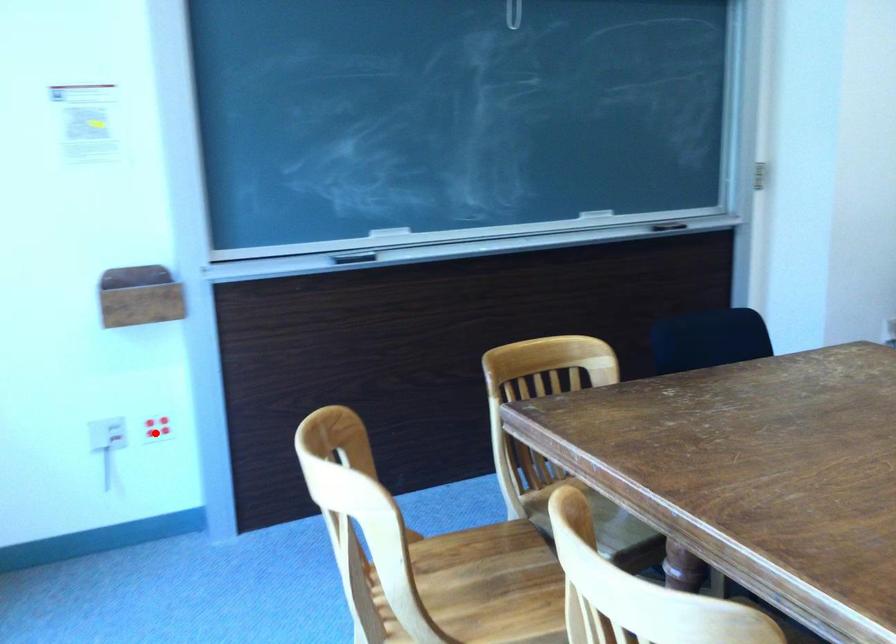
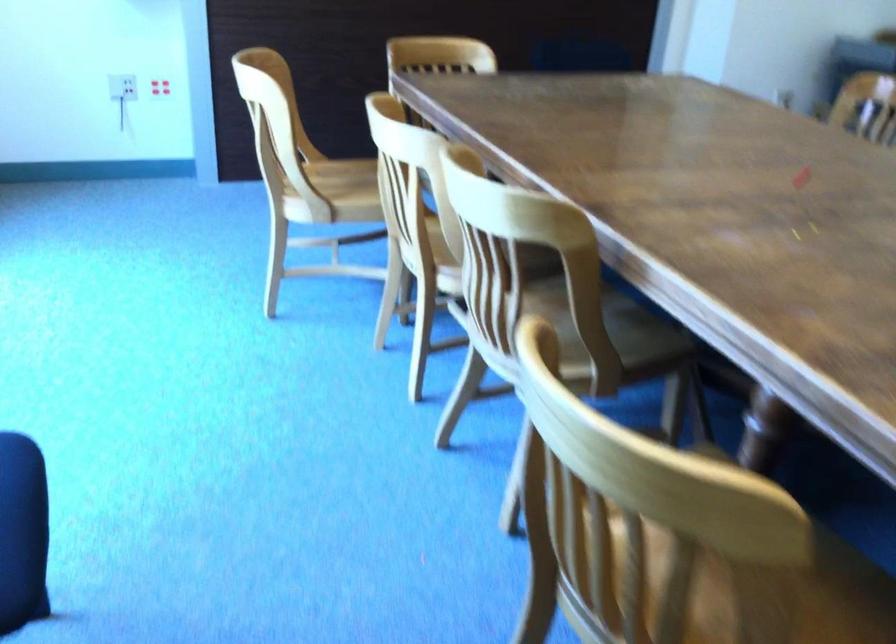
Question: I am providing you with two images of the same scene from different viewpoints. A red point is marked on the first image. At the location where the point appears in image 1, is it still visible in image 2?

Choices:
 (A) Yes
 (B) No

Answer: (A)